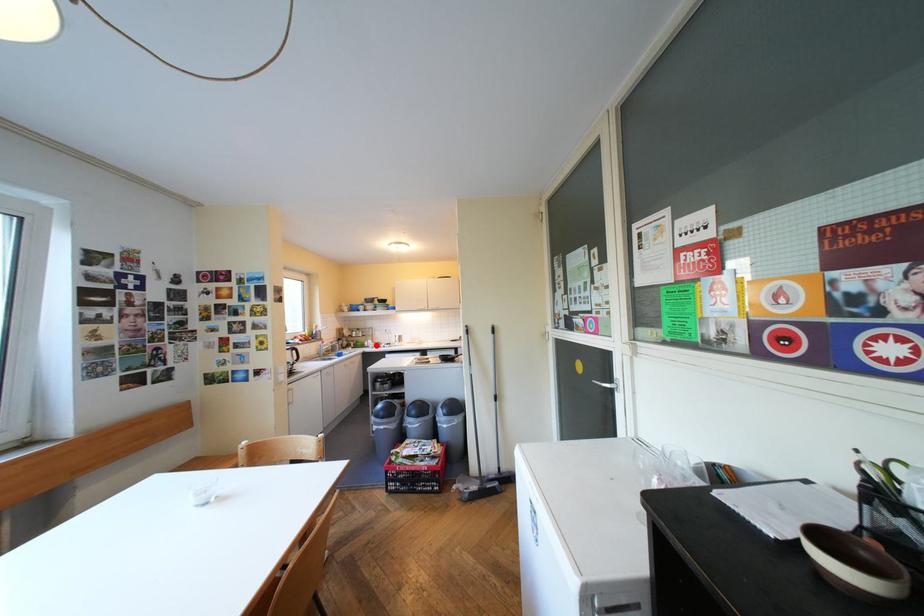
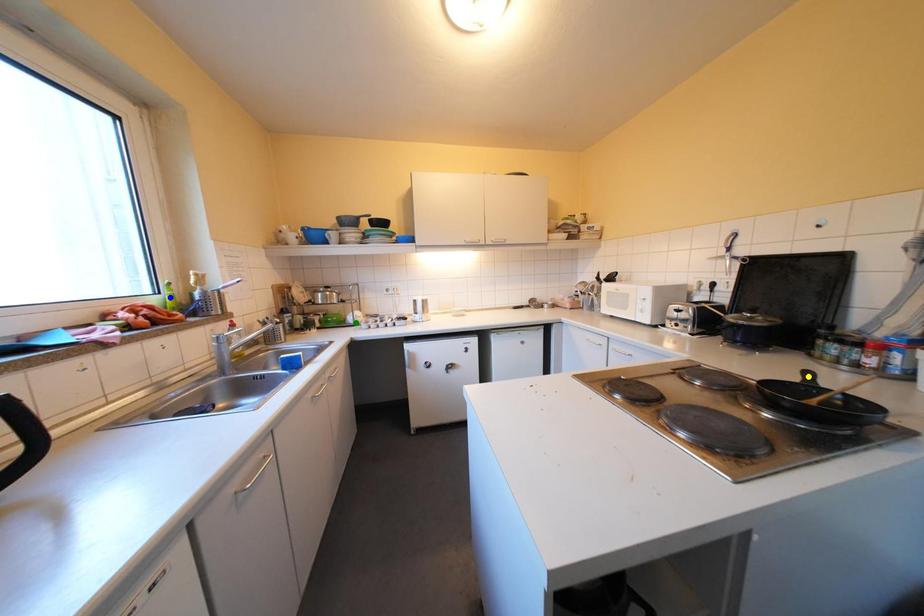
Question: I am providing you with two images of the same scene from different viewpoints. A red point is marked on the first image. You are given multiple points on the second image. Can you choose the point in image 2 that corresponds to the point in image 1?

Choices:
 (A) yellow point
 (B) green point
 (C) blue point

Answer: (B)